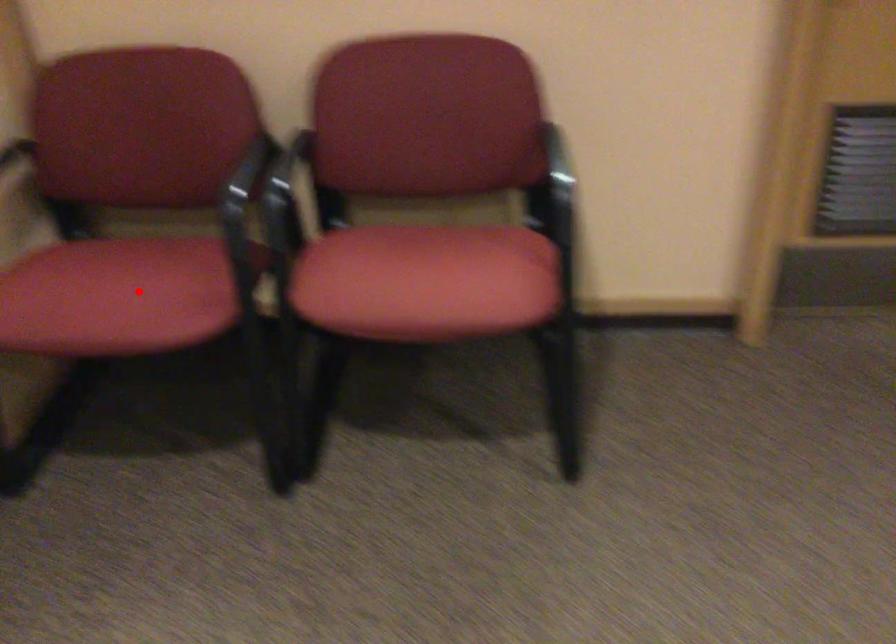
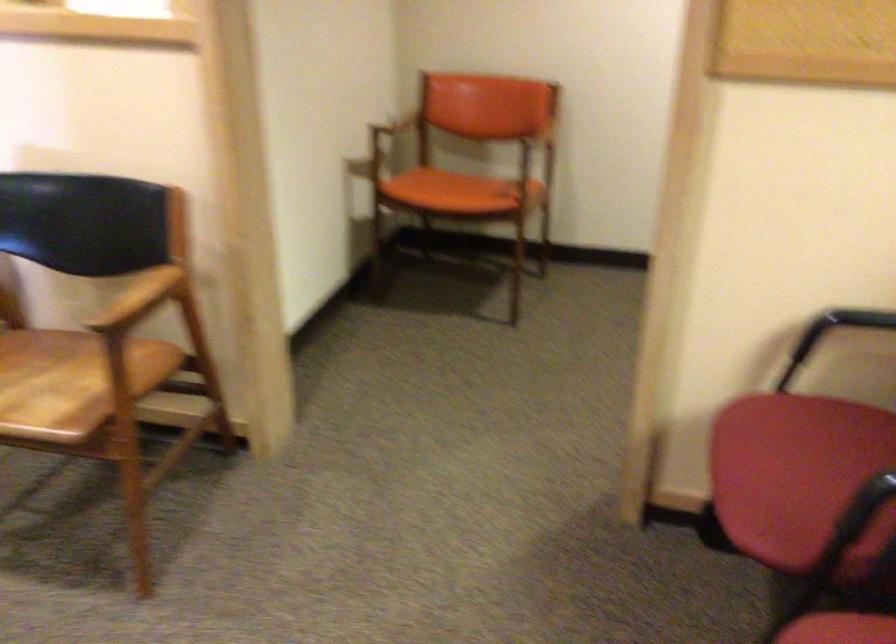
Question: I am providing you with two images of the same scene from different viewpoints. A red point is shown in image1. For the corresponding object point in image2, is it positioned nearer or farther from the camera?

Choices:
 (A) Nearer
 (B) Farther

Answer: (A)